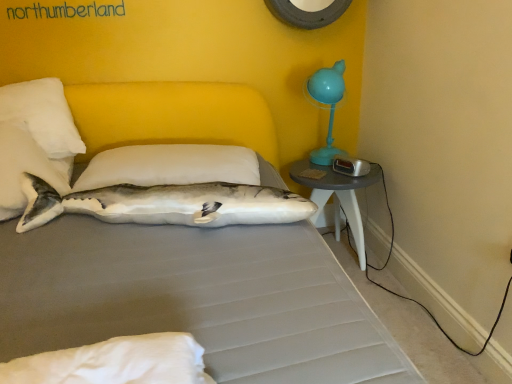
Question: Is white fabric shark at center thinner than white plush shark at upper left, the 1th pillow from the left?

Choices:
 (A) yes
 (B) no

Answer: (A)

Question: From a real-world perspective, does white fabric shark at center sit lower than white plush shark at upper left, the second pillow in the right-to-left sequence?

Choices:
 (A) no
 (B) yes

Answer: (B)

Question: Is white plush shark at upper left, the 1th pillow from the left, a part of white fabric shark at center?

Choices:
 (A) yes
 (B) no

Answer: (B)

Question: Would you say white fabric shark at center is a long distance from white plush shark at upper left, the second pillow in the right-to-left sequence?

Choices:
 (A) no
 (B) yes

Answer: (A)

Question: Is white fabric shark at center oriented away from white plush shark at upper left, the second pillow in the right-to-left sequence?

Choices:
 (A) yes
 (B) no

Answer: (A)

Question: Considering the relative sizes of white fabric shark at center and white plush shark at upper left, the second pillow in the right-to-left sequence, in the image provided, is white fabric shark at center taller than white plush shark at upper left, the second pillow in the right-to-left sequence,?

Choices:
 (A) yes
 (B) no

Answer: (B)

Question: Are white soft pillow at center, arranged as the 2th pillow when viewed from the left, and white plush shark at upper left, the second pillow in the right-to-left sequence, far apart?

Choices:
 (A) yes
 (B) no

Answer: (B)

Question: Can you confirm if white soft pillow at center, arranged as the 2th pillow when viewed from the left, is positioned to the right of white plush shark at upper left, the 1th pillow from the left?

Choices:
 (A) no
 (B) yes

Answer: (B)

Question: Does white soft pillow at center, which is the first pillow from right to left, turn towards white plush shark at upper left, the second pillow in the right-to-left sequence?

Choices:
 (A) no
 (B) yes

Answer: (A)

Question: From the image's perspective, is white soft pillow at center, arranged as the 2th pillow when viewed from the left, above white plush shark at upper left, the second pillow in the right-to-left sequence?

Choices:
 (A) no
 (B) yes

Answer: (B)

Question: Does white soft pillow at center, arranged as the 2th pillow when viewed from the left, lie in front of white plush shark at upper left, the second pillow in the right-to-left sequence?

Choices:
 (A) yes
 (B) no

Answer: (B)

Question: From a real-world perspective, is white soft pillow at center, arranged as the 2th pillow when viewed from the left, beneath white plush shark at upper left, the second pillow in the right-to-left sequence?

Choices:
 (A) no
 (B) yes

Answer: (B)

Question: Does white soft pillow at center, which is the first pillow from right to left, have a greater width compared to white fabric shark at center?

Choices:
 (A) no
 (B) yes

Answer: (B)